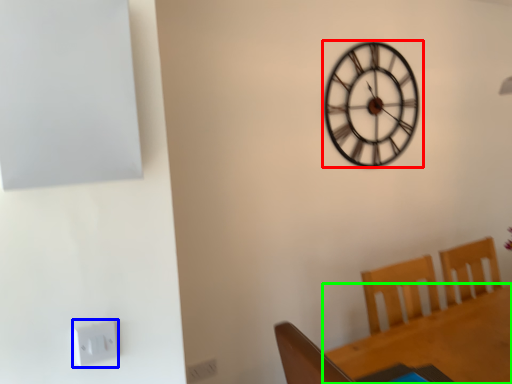
Question: Which object is positioned closest to wall clock (highlighted by a red box)? Select from electric outlet (highlighted by a blue box) and round table (highlighted by a green box).

Choices:
 (A) electric outlet
 (B) round table

Answer: (B)